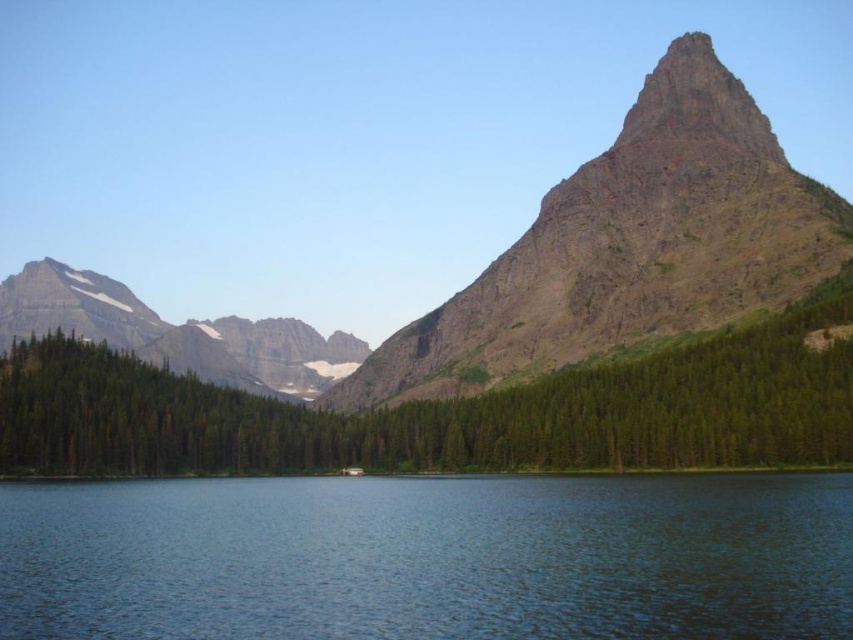
You are standing at the edge of the water and want to walk towards the rugged granite mountain at center. Which direction should you head to avoid the green matte forest at center?

Since the green matte forest at center is to the right of the rugged granite mountain at center, you should head to the left to avoid it while walking towards the mountain.

You are standing on the shore of the blue water at center and want to hike to the rugged granite mountain at center. Based on the scene, which direction should you head towards to reach the mountain?

The rugged granite mountain at center is located towards the right side of the scene, so you should head towards the right to reach it.